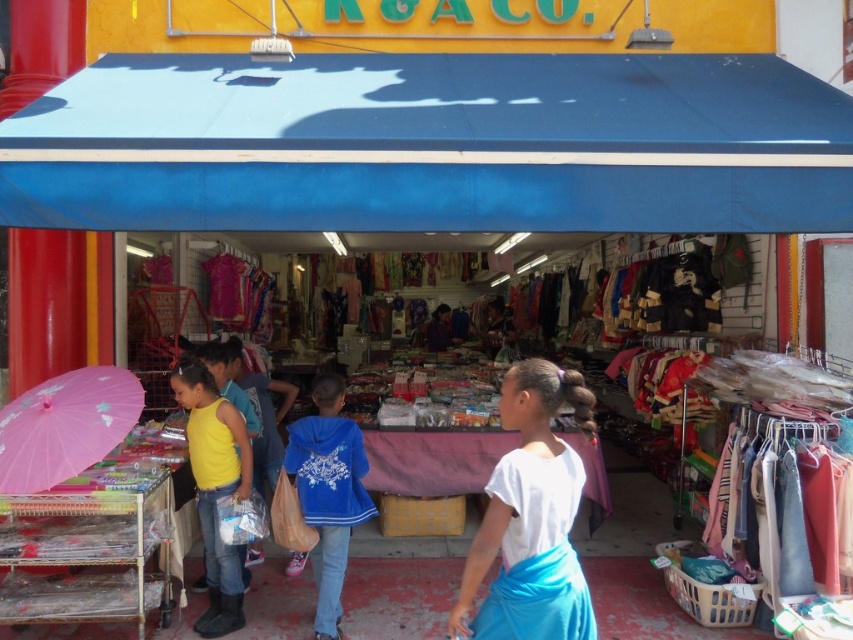
You are a customer at the market stall and want to locate the white matte shirt at center. Where should you look relative to the stall entrance?

The white matte shirt at center is located at the coordinates (x=531, y=518), which would be towards the center area of the stall, so you should look towards the center of the stall relative to the entrance.

You are a customer at the market stall and want to pick up the white matte shirt at center and the yellow matte tank top at lower left. Which item should you reach for first if you want to grab the one that is higher up?

The white matte shirt at center is located above the yellow matte tank top at lower left, so you should reach for the white matte shirt at center first.